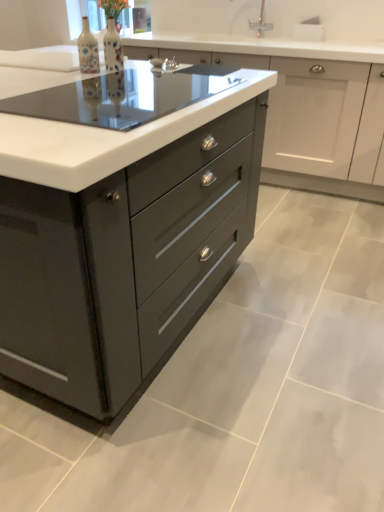
Question: Is matte ceramic vase at upper center, acting as the 2th bottle starting from the left, thinner than matte black cooktop at center?

Choices:
 (A) no
 (B) yes

Answer: (B)

Question: From the image's perspective, is matte ceramic vase at upper center, the 1th bottle when ordered from right to left, located above matte black cooktop at center?

Choices:
 (A) no
 (B) yes

Answer: (B)

Question: From a real-world perspective, is matte ceramic vase at upper center, the 1th bottle when ordered from right to left, beneath matte black cooktop at center?

Choices:
 (A) no
 (B) yes

Answer: (A)

Question: Is the depth of matte ceramic vase at upper center, acting as the 2th bottle starting from the left, greater than that of matte black cooktop at center?

Choices:
 (A) yes
 (B) no

Answer: (A)

Question: Can you confirm if matte ceramic vase at upper center, the 1th bottle when ordered from right to left, is wider than matte black cooktop at center?

Choices:
 (A) yes
 (B) no

Answer: (B)

Question: Is matte ceramic bottle at upper left, the first bottle viewed from the left, inside or outside of matte ceramic vase at upper center, the 1th bottle when ordered from right to left?

Choices:
 (A) outside
 (B) inside

Answer: (A)

Question: From the image's perspective, is matte ceramic bottle at upper left, the second bottle from the right, located above or below matte ceramic vase at upper center, acting as the 2th bottle starting from the left?

Choices:
 (A) above
 (B) below

Answer: (B)

Question: Relative to matte ceramic vase at upper center, the 1th bottle when ordered from right to left, is matte ceramic bottle at upper left, the first bottle viewed from the left, in front or behind?

Choices:
 (A) behind
 (B) front

Answer: (B)

Question: Considering the positions of matte ceramic bottle at upper left, the second bottle from the right, and matte ceramic vase at upper center, acting as the 2th bottle starting from the left, in the image, is matte ceramic bottle at upper left, the second bottle from the right, taller or shorter than matte ceramic vase at upper center, acting as the 2th bottle starting from the left,?

Choices:
 (A) tall
 (B) short

Answer: (B)

Question: Considering the positions of point (79, 62) and point (115, 120), is point (79, 62) closer or farther from the camera than point (115, 120)?

Choices:
 (A) closer
 (B) farther

Answer: (B)

Question: Looking at their shapes, would you say matte ceramic bottle at upper left, the second bottle from the right, is wider or thinner than matte black cooktop at center?

Choices:
 (A) wide
 (B) thin

Answer: (B)

Question: Considering the relative positions of matte ceramic bottle at upper left, the second bottle from the right, and matte black cooktop at center in the image provided, is matte ceramic bottle at upper left, the second bottle from the right, to the left or to the right of matte black cooktop at center?

Choices:
 (A) left
 (B) right

Answer: (A)

Question: In the image, is matte ceramic bottle at upper left, the second bottle from the right, positioned in front of or behind matte black cooktop at center?

Choices:
 (A) front
 (B) behind

Answer: (B)

Question: In terms of height, does glossy dark gray chest of drawers at center look taller or shorter compared to matte gray cabinet at center?

Choices:
 (A) tall
 (B) short

Answer: (A)

Question: In terms of width, does glossy dark gray chest of drawers at center look wider or thinner when compared to matte gray cabinet at center?

Choices:
 (A) thin
 (B) wide

Answer: (B)